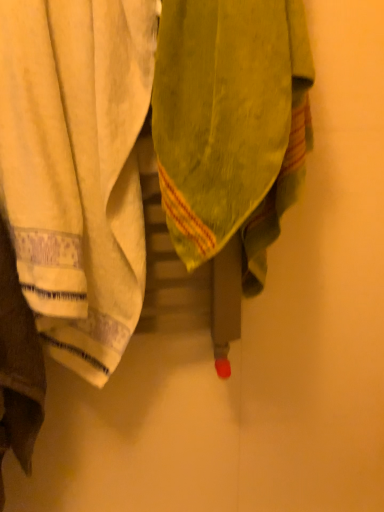
Question: Can you confirm if green textured towel at center, acting as the 1th towel starting from the right, is wider than white cotton towel at left, the first towel when ordered from left to right?

Choices:
 (A) no
 (B) yes

Answer: (B)

Question: Can you confirm if green textured towel at center, acting as the 1th towel starting from the right, is shorter than white cotton towel at left, the first towel when ordered from left to right?

Choices:
 (A) yes
 (B) no

Answer: (A)

Question: Is green textured towel at center, which ranks as the 2th towel in left-to-right order, facing away from white cotton towel at left, the first towel when ordered from left to right?

Choices:
 (A) no
 (B) yes

Answer: (A)

Question: Is green textured towel at center, which ranks as the 2th towel in left-to-right order, taller than white cotton towel at left, which is counted as the 2th towel, starting from the right?

Choices:
 (A) no
 (B) yes

Answer: (A)

Question: Is green textured towel at center, acting as the 1th towel starting from the right, aimed at white cotton towel at left, the first towel when ordered from left to right?

Choices:
 (A) yes
 (B) no

Answer: (B)

Question: From a real-world perspective, is green textured towel at center, which ranks as the 2th towel in left-to-right order, under white cotton towel at left, which is counted as the 2th towel, starting from the right?

Choices:
 (A) yes
 (B) no

Answer: (B)

Question: From the image's perspective, is white cotton towel at left, which is counted as the 2th towel, starting from the right, over green textured towel at center, which ranks as the 2th towel in left-to-right order?

Choices:
 (A) yes
 (B) no

Answer: (B)

Question: Is white cotton towel at left, which is counted as the 2th towel, starting from the right, located outside green textured towel at center, which ranks as the 2th towel in left-to-right order?

Choices:
 (A) no
 (B) yes

Answer: (B)

Question: From a real-world perspective, does white cotton towel at left, which is counted as the 2th towel, starting from the right, stand above green textured towel at center, which ranks as the 2th towel in left-to-right order?

Choices:
 (A) yes
 (B) no

Answer: (B)

Question: From the image's perspective, is white cotton towel at left, which is counted as the 2th towel, starting from the right, under green textured towel at center, which ranks as the 2th towel in left-to-right order?

Choices:
 (A) no
 (B) yes

Answer: (B)

Question: Is white cotton towel at left, the first towel when ordered from left to right, at the right side of green textured towel at center, acting as the 1th towel starting from the right?

Choices:
 (A) no
 (B) yes

Answer: (A)

Question: Is white cotton towel at left, which is counted as the 2th towel, starting from the right, wider than green textured towel at center, which ranks as the 2th towel in left-to-right order?

Choices:
 (A) yes
 (B) no

Answer: (B)

Question: Looking at their shapes, would you say green textured towel at center, which ranks as the 2th towel in left-to-right order, is wider or thinner than white cotton towel at left, which is counted as the 2th towel, starting from the right?

Choices:
 (A) wide
 (B) thin

Answer: (A)